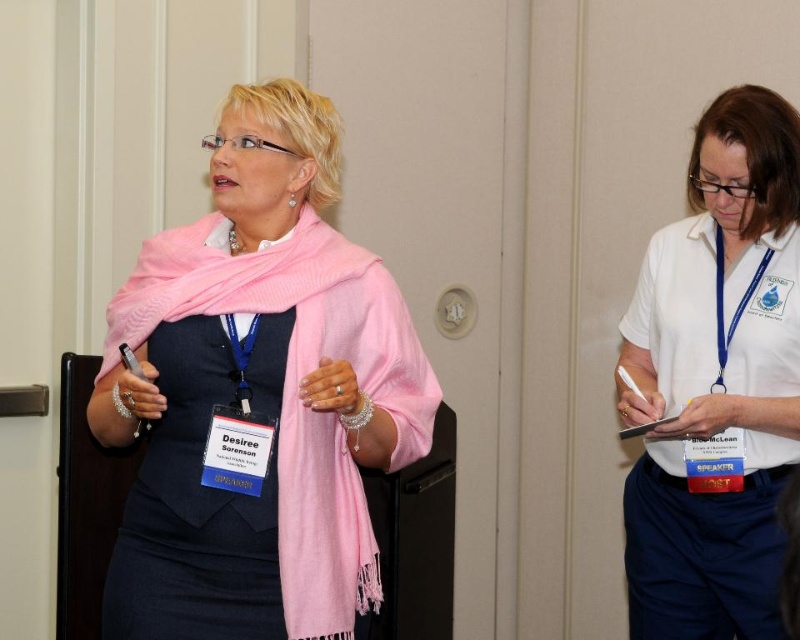
You are organizing a photo shoot and need to arrange two outfits on a mannequin stand. The stand can only hold items up to 1 meter in width. You have the white smooth shirt at right and the black satin dress at center. Based on the image, which outfit should you choose to ensure it fits within the stand?

The white smooth shirt at right might be wider than the black satin dress at center, so the black satin dress at center is more likely to fit within the 1 meter width limit of the stand.

You are an event photographer who needs to capture a clear photo of both the white smooth shirt at right and the black satin dress at center. Since you can only focus on one subject at a time, which one should you focus on first to ensure the other is also in focus?

The white smooth shirt at right is further to the viewer than the black satin dress at center, so focusing on the white smooth shirt at right first will ensure the black satin dress at center is also in focus due to depth of field.

You are a photographer trying to focus on two points in the image, point (130, 396) and point (716, 628). Which point should you adjust your focus to first if you want to capture both clearly?

Point (130, 396) is closer to the camera than point (716, 628), so you should focus on point (130, 396) first to ensure both are in focus.